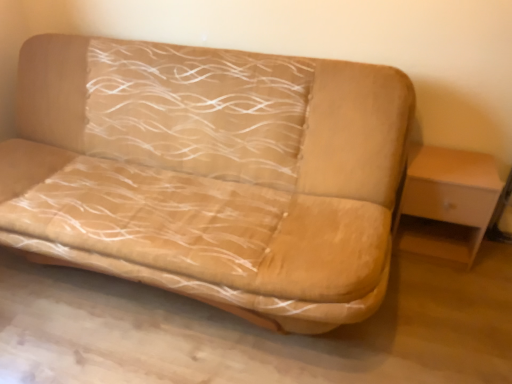
Question: In terms of size, does light wood/wooden table at right appear bigger or smaller than beige fabric couch at center?

Choices:
 (A) big
 (B) small

Answer: (B)

Question: Is light wood/wooden table at right taller or shorter than beige fabric couch at center?

Choices:
 (A) tall
 (B) short

Answer: (B)

Question: Relative to beige fabric couch at center, is light wood/wooden table at right in front or behind?

Choices:
 (A) front
 (B) behind

Answer: (B)

Question: Based on their positions, is beige fabric couch at center located to the left or right of light wood/wooden table at right?

Choices:
 (A) right
 (B) left

Answer: (B)

Question: From the image's perspective, is beige fabric couch at center positioned above or below light wood/wooden table at right?

Choices:
 (A) above
 (B) below

Answer: (A)

Question: Considering the positions of beige fabric couch at center and light wood/wooden table at right in the image, is beige fabric couch at center taller or shorter than light wood/wooden table at right?

Choices:
 (A) tall
 (B) short

Answer: (A)

Question: Relative to light wood/wooden table at right, is beige fabric couch at center in front or behind?

Choices:
 (A) front
 (B) behind

Answer: (A)